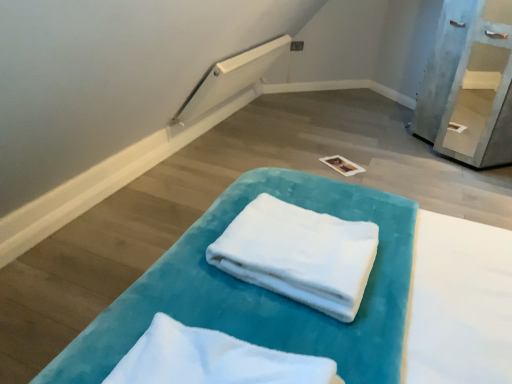
Question: Is velvet teal towel at center behind white soft towel at center, which is counted as the 1th cloth, starting from the front?

Choices:
 (A) no
 (B) yes

Answer: (B)

Question: Is white soft towel at center, which appears as the 2th cloth when viewed from the back, a part of velvet teal towel at center?

Choices:
 (A) no
 (B) yes

Answer: (A)

Question: From a real-world perspective, is velvet teal towel at center on top of white soft towel at center, which appears as the 2th cloth when viewed from the back?

Choices:
 (A) no
 (B) yes

Answer: (A)

Question: Is velvet teal towel at center shorter than white soft towel at center, which appears as the 2th cloth when viewed from the back?

Choices:
 (A) no
 (B) yes

Answer: (B)

Question: Could you tell me if velvet teal towel at center is facing white soft towel at center, which is counted as the 1th cloth, starting from the front?

Choices:
 (A) no
 (B) yes

Answer: (A)

Question: Does velvet teal towel at center appear on the right side of white soft towel at center, which appears as the 2th cloth when viewed from the back?

Choices:
 (A) no
 (B) yes

Answer: (B)

Question: Does light blue painted wood shelf at upper right have a lesser width compared to white soft towel at center, placed as the first cloth when sorted from back to front?

Choices:
 (A) yes
 (B) no

Answer: (B)

Question: Is light blue painted wood shelf at upper right positioned beyond the bounds of white soft towel at center, the second cloth in the front-to-back sequence?

Choices:
 (A) no
 (B) yes

Answer: (B)

Question: Is white soft towel at center, placed as the first cloth when sorted from back to front, surrounded by light blue painted wood shelf at upper right?

Choices:
 (A) yes
 (B) no

Answer: (B)

Question: Is light blue painted wood shelf at upper right facing away from white soft towel at center, placed as the first cloth when sorted from back to front?

Choices:
 (A) yes
 (B) no

Answer: (B)

Question: Can you confirm if light blue painted wood shelf at upper right is bigger than white soft towel at center, the second cloth in the front-to-back sequence?

Choices:
 (A) no
 (B) yes

Answer: (B)

Question: Is light blue painted wood shelf at upper right further to the viewer compared to white soft towel at center, the second cloth in the front-to-back sequence?

Choices:
 (A) no
 (B) yes

Answer: (B)

Question: Can you confirm if white soft towel at center, which is counted as the 1th cloth, starting from the front, is positioned to the left of white soft towel at center, the second cloth in the front-to-back sequence?

Choices:
 (A) yes
 (B) no

Answer: (A)